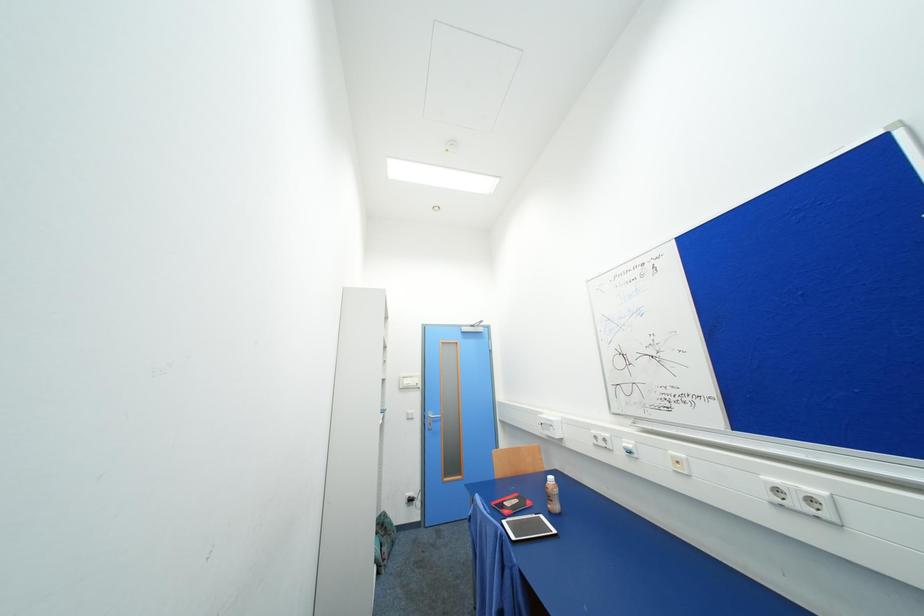
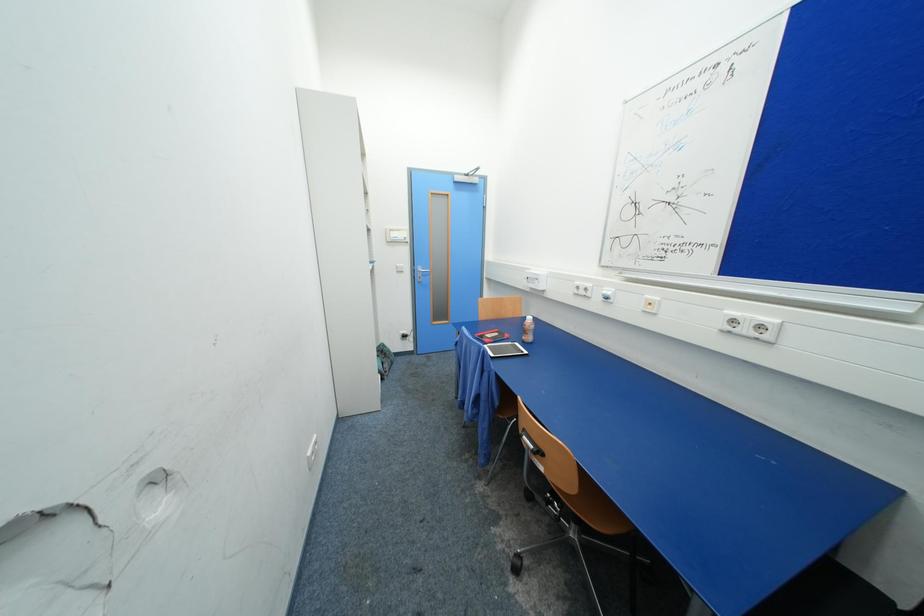
In a continuous first-person perspective shot, in which direction is the camera moving?

The cameraman moved toward left, forward.